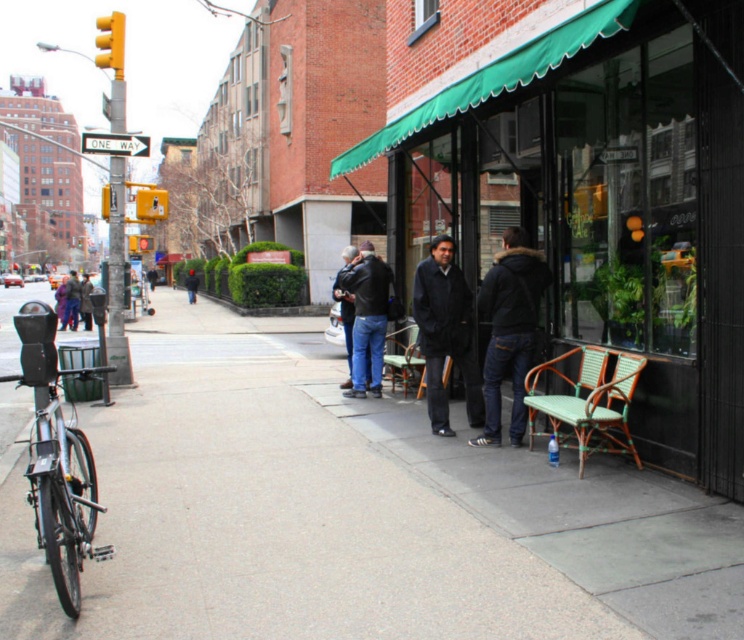
Between point (513, 292) and point (362, 381), which one is positioned in front?

Point (513, 292) is more forward.

Measure the distance between point (493, 340) and camera.

They are 7.23 meters apart.

Does point (525, 428) come farther from viewer compared to point (355, 332)?

No, it is in front of (355, 332).

Locate an element on the screen. This screenshot has width=744, height=640. dark blue jeans at center is located at coordinates (509, 330).

Does green fabric awning at upper right appear on the right side of dark blue jacket at center?

Yes, green fabric awning at upper right is to the right of dark blue jacket at center.

Where is `green fabric awning at upper right`? Image resolution: width=744 pixels, height=640 pixels. green fabric awning at upper right is located at coordinates (589, 186).

Is dark brown leather jacket at center behind dark blue jacket at center?

No, dark brown leather jacket at center is in front of dark blue jacket at center.

Does point (86, 314) come farther from viewer compared to point (193, 292)?

That is False.

The width and height of the screenshot is (744, 640). I want to click on dark brown leather jacket at center, so click(x=86, y=301).